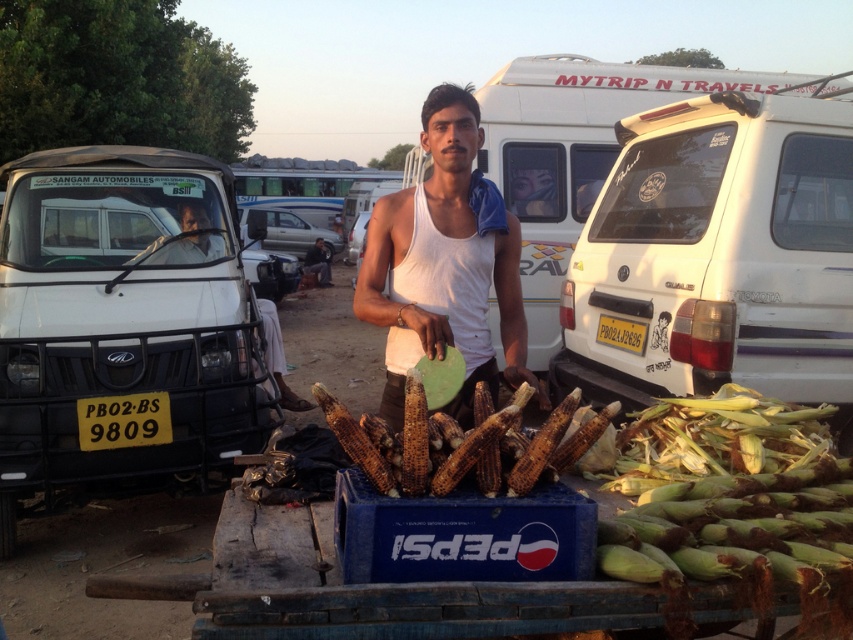
You are a delivery person who needs to park your 10 feet long truck near the white matte van at right. Can you park your truck without overlapping the van?

The white matte van at right is 10.60 feet away from the camera. Since your truck is 10 feet long, you can park it near the van without overlapping as there is sufficient space between them.

You are a photographer trying to capture the man and his stall in a photo. You notice the white matte van at right and the white cotton tank top at center. Which object should you position closer to the foreground to ensure the man is clearly visible without obstruction?

The white cotton tank top at center should be positioned closer to the foreground because the white matte van at right is taller than the white cotton tank top at center, so placing the shorter object closer would prevent the taller van from blocking the man.